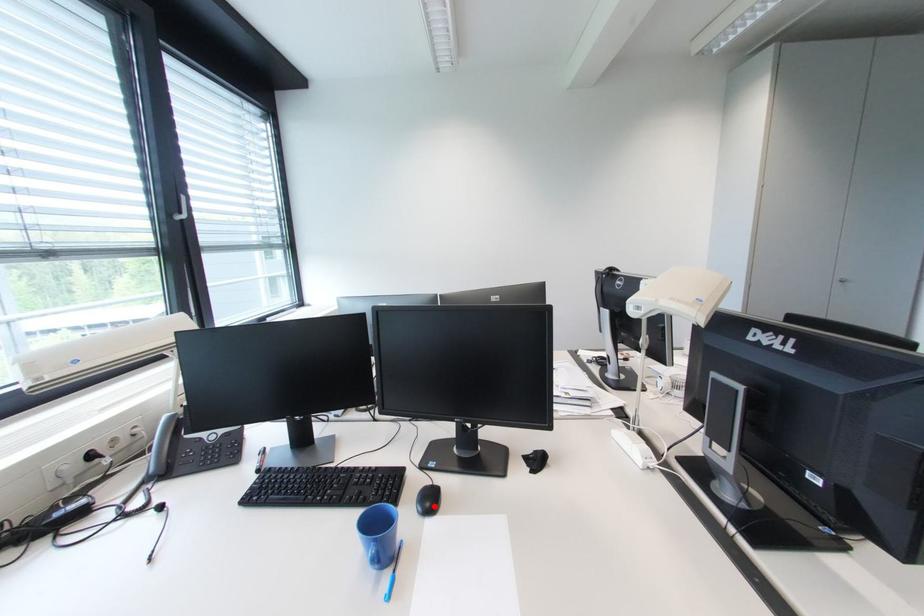
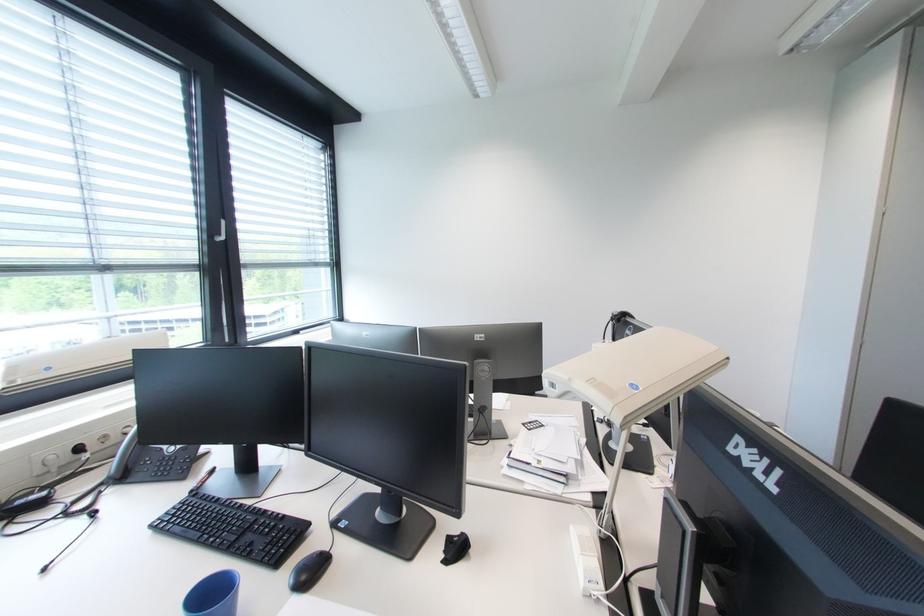
Find the pixel in the second image that matches the highlighted location in the first image.

(310, 578)